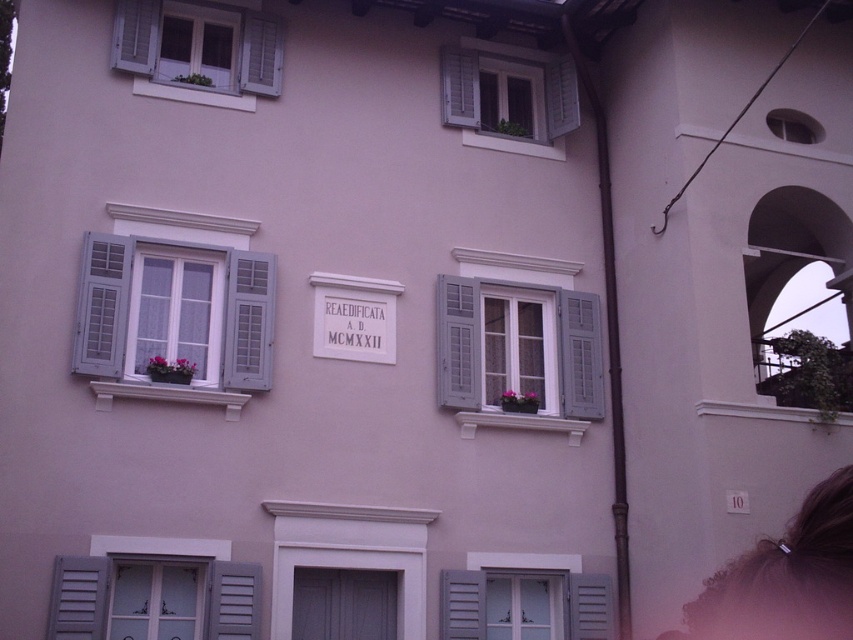
Question: Is matte gray shutters at upper center to the right of matte white flower box at lower left from the viewer's perspective?

Choices:
 (A) no
 (B) yes

Answer: (B)

Question: Which is farther from the matte white flower box at lower left?

Choices:
 (A) matte gray shutters at center
 (B) matte gray shutters at left
 (C) matte gray shutters at lower center
 (D) matte black flower box at center

Answer: (C)

Question: Which of the following is the farthest from the observer?

Choices:
 (A) matte gray shutters at left
 (B) matte white flower box at lower left

Answer: (B)

Question: Does white painted wood window at upper left lie behind matte gray shutters at upper center?

Choices:
 (A) yes
 (B) no

Answer: (B)

Question: Among these points, which one is farthest from the camera?

Choices:
 (A) (466, 330)
 (B) (502, 401)
 (C) (178, 60)

Answer: (C)

Question: Where is white painted wood window at upper left located in relation to matte black flower box at center in the image?

Choices:
 (A) right
 (B) left

Answer: (B)